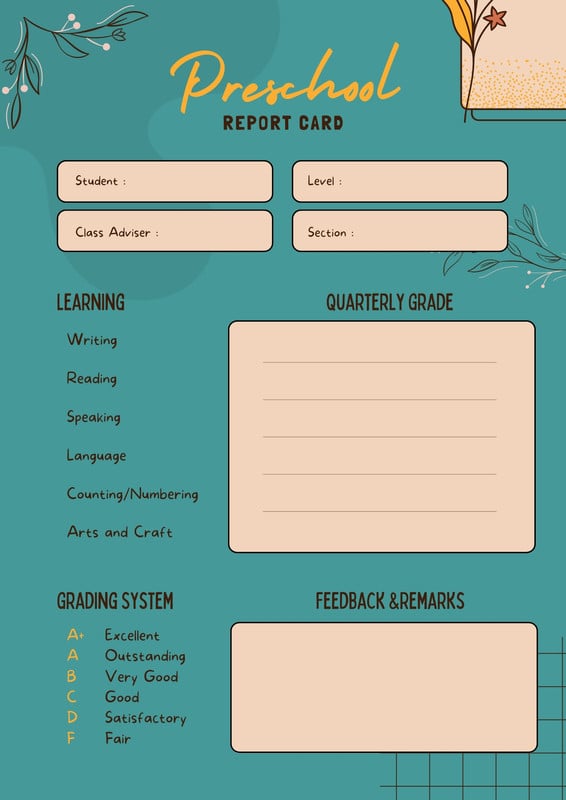
You are a GUI agent. You are given a task and a screenshot of the screen. Output one action in this format:
    pyautogui.click(x=<x>, y=<y>)
    Task: Click on the box
    This screenshot has width=566, height=800.
    Given the screenshot: What is the action you would take?
    pyautogui.click(x=171, y=181)